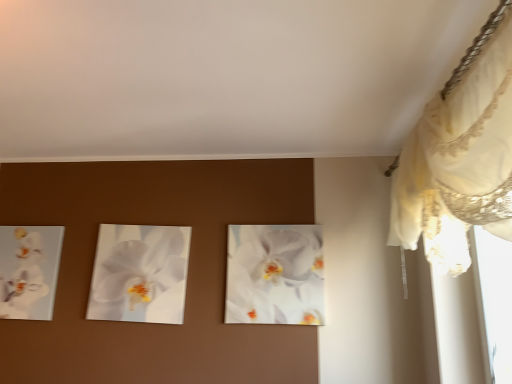
Question: Considering the positions of white glossy orchid at center, the 2th flower when ordered from right to left, and white lace curtain at upper right in the image, is white glossy orchid at center, the 2th flower when ordered from right to left, bigger or smaller than white lace curtain at upper right?

Choices:
 (A) big
 (B) small

Answer: (B)

Question: From the image's perspective, is white glossy orchid at center, which is the 2th flower from left to right, located above or below white lace curtain at upper right?

Choices:
 (A) below
 (B) above

Answer: (A)

Question: Which of these objects is positioned closest to the white glossy orchid at left, which appears as the 1th flower when viewed from the left?

Choices:
 (A) white glossy orchid at center, the 2th flower when ordered from right to left
 (B) white glossy orchid at center, which is the 3th flower in left-to-right order
 (C) white lace curtain at upper right

Answer: (A)

Question: Which is farther from the white glossy orchid at center, which is the 2th flower from left to right?

Choices:
 (A) white glossy orchid at center, which is the 3th flower in left-to-right order
 (B) white lace curtain at upper right
 (C) white glossy orchid at left, which ranks as the third flower in right-to-left order

Answer: (B)